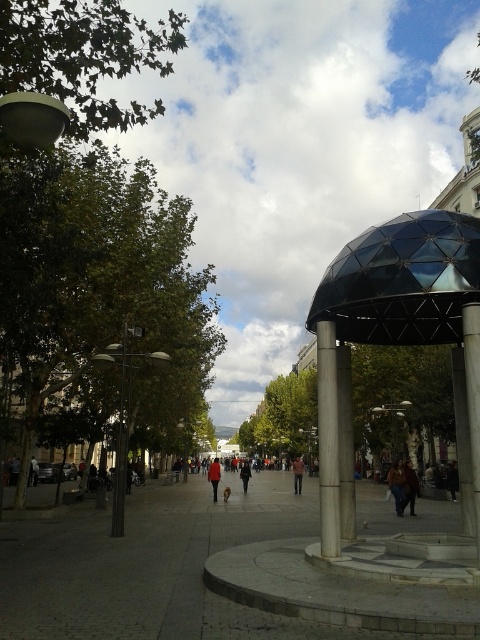
Can you confirm if transparent glass dome at upper right is shorter than dark gray fabric jacket at center?

Yes, transparent glass dome at upper right is shorter than dark gray fabric jacket at center.

Can you confirm if transparent glass dome at upper right is smaller than dark gray fabric jacket at center?

Indeed, transparent glass dome at upper right has a smaller size compared to dark gray fabric jacket at center.

Is point (423, 228) closer to camera compared to point (247, 483)?

That is True.

At what (x,y) coordinates should I click in order to perform the action: click on transparent glass dome at upper right. Please return your answer as a coordinate pair (x, y). The width and height of the screenshot is (480, 640). Looking at the image, I should click on (403, 280).

Does point (41, 547) lie in front of point (300, 481)?

Yes, point (41, 547) is closer to viewer.

The width and height of the screenshot is (480, 640). What are the coordinates of `gray concrete pavement at center` in the screenshot? It's located at (154, 564).

Between point (409, 493) and point (241, 477), which one is positioned in front?

Point (409, 493) is more forward.

Who is positioned more to the left, brown leather jacket at center or dark gray fabric jacket at center?

dark gray fabric jacket at center

Between point (414, 476) and point (245, 472), which one is positioned in front?

Point (414, 476)

The image size is (480, 640). I want to click on brown leather jacket at center, so click(x=409, y=486).